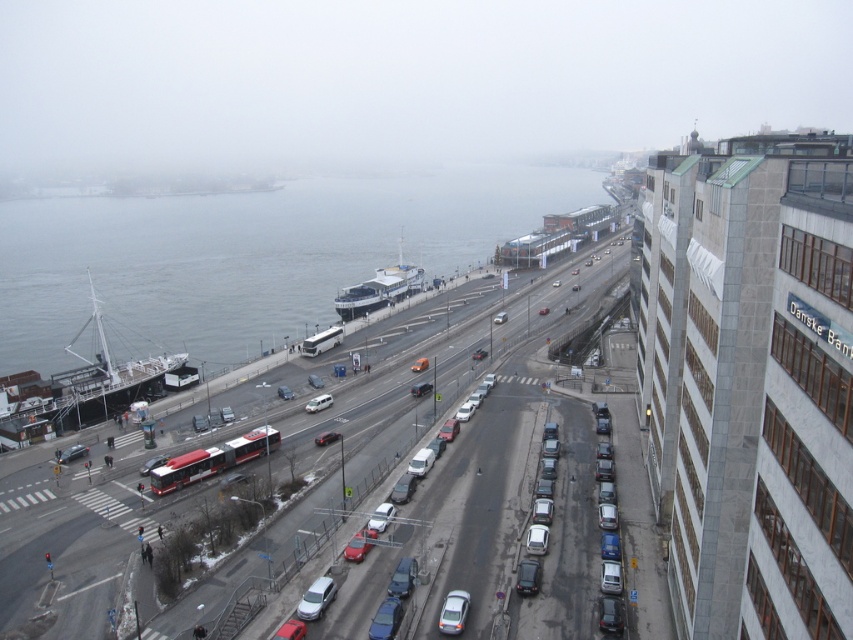
You are standing at the waterfront area near the ship and want to walk to the tram. You have two paths to choose from, one leading to point A at coordinates point (517, 593) and the other to point B at coordinates point (277, 632). Which path will get you closer to the tram?

Point A at coordinates point (517, 593) is closer to the tram because it is further to the viewer than point B at coordinates point (277, 632), meaning it is physically nearer in the scene.

In the scene shown: You are driving a satin silver sedan at center and want to make a quick left turn onto a side street. Since the smooth asphalt highway at center is wider than your car, can you safely perform a sharp turn without crossing into the opposing traffic lane?

The smooth asphalt highway at center is wider than the satin silver sedan at center, so yes, you can safely make a sharp left turn without crossing into the opposing traffic lane as there is sufficient width available.

What is the exact coordinate of the smooth asphalt highway at center?

The smooth asphalt highway at center is located at coordinate point [462,429].